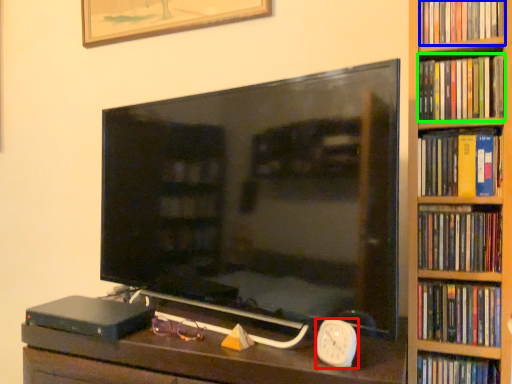
Question: Considering the real-world distances, which object is closest to clock (highlighted by a red box)? book (highlighted by a blue box) or book (highlighted by a green box).

Choices:
 (A) book
 (B) book

Answer: (B)